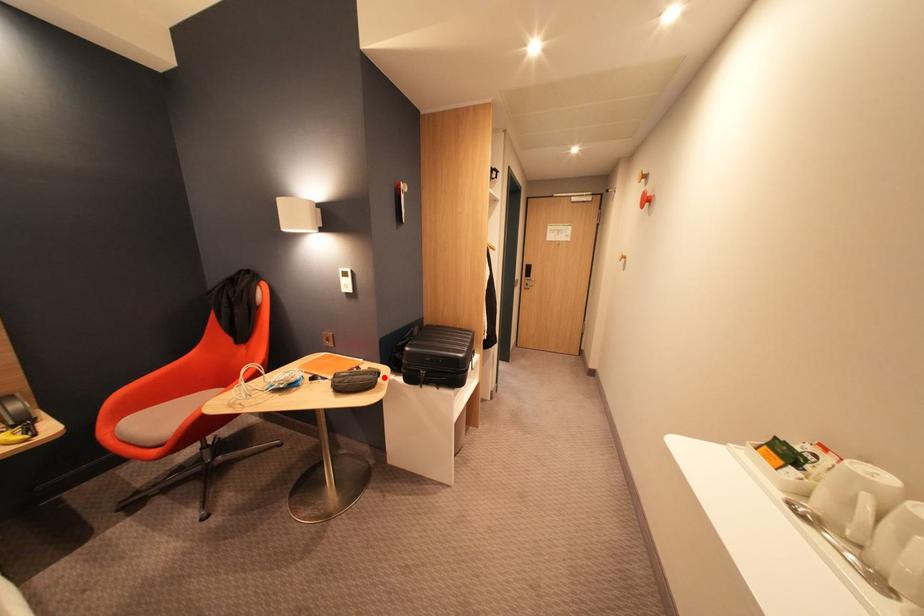
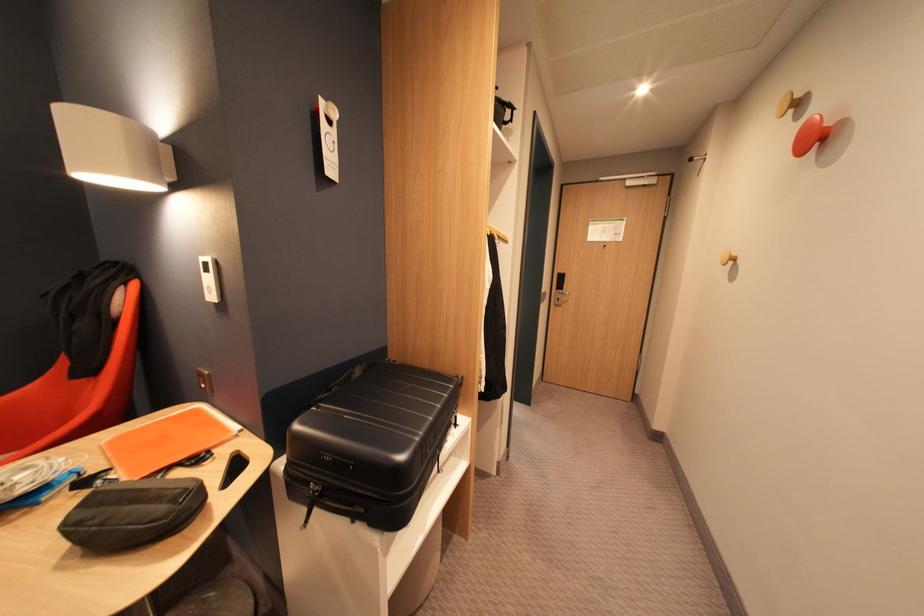
In the second image, find the point that corresponds to the highlighted location in the first image.

(186, 508)